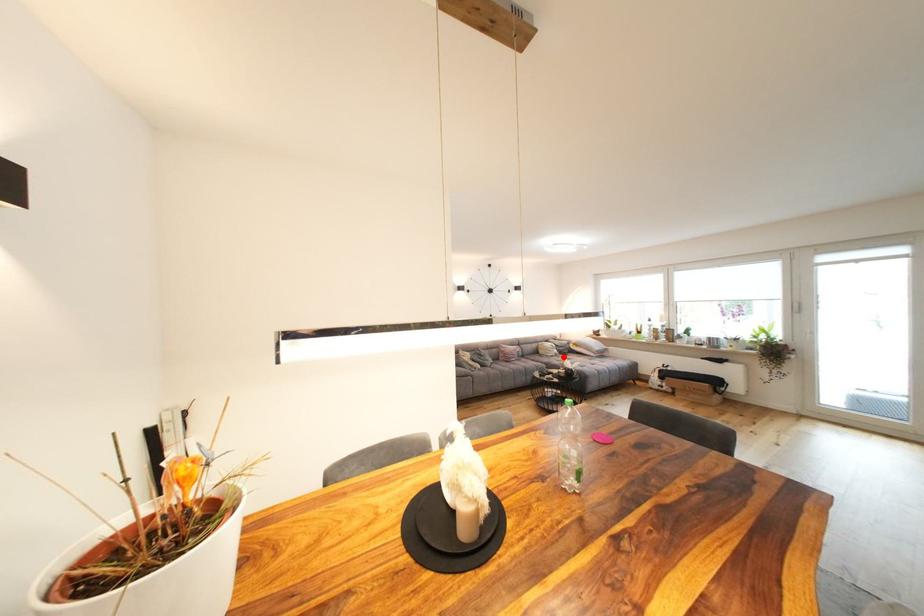
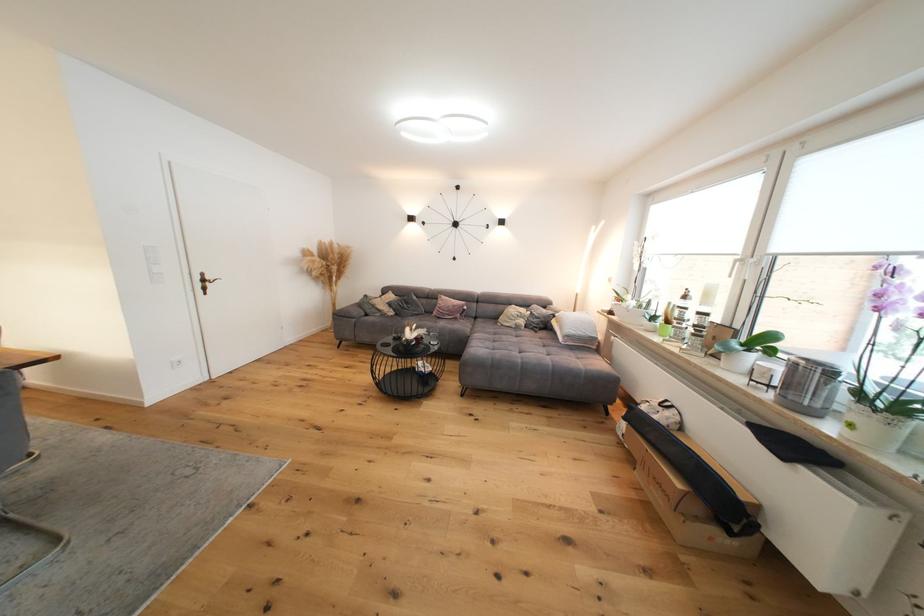
Locate, in the second image, the point that corresponds to the highlighted location in the first image.

(524, 330)